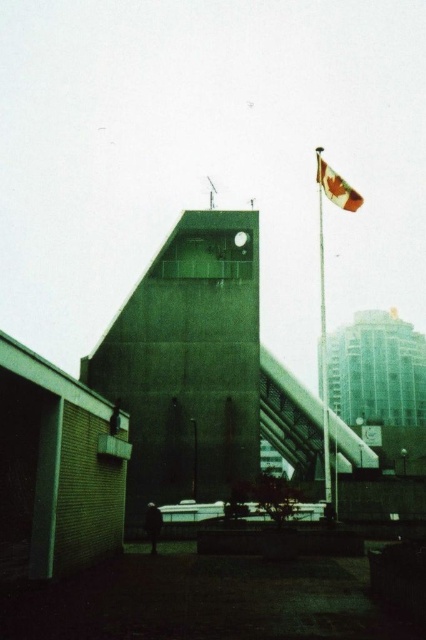
Between point (244, 477) and point (328, 189), which one is positioned in front?

Point (328, 189)

Between green concrete bell tower at center and red fabric flag at upper right, which one has less height?

Standing shorter between the two is green concrete bell tower at center.

Where is `green concrete bell tower at center`? The width and height of the screenshot is (426, 640). green concrete bell tower at center is located at coordinates click(189, 362).

Who is positioned more to the left, polished metal flag pole at upper right or red fabric flag at upper right?

Positioned to the left is red fabric flag at upper right.

Is polished metal flag pole at upper right bigger than red fabric flag at upper right?

Yes.

The width and height of the screenshot is (426, 640). Describe the element at coordinates (322, 330) in the screenshot. I see `polished metal flag pole at upper right` at that location.

Where is `polished metal flag pole at upper right`? polished metal flag pole at upper right is located at coordinates (322, 330).

Is green concrete bell tower at center below polished metal flag pole at upper right?

Indeed, green concrete bell tower at center is positioned under polished metal flag pole at upper right.

Identify the location of green concrete bell tower at center. The image size is (426, 640). (189, 362).